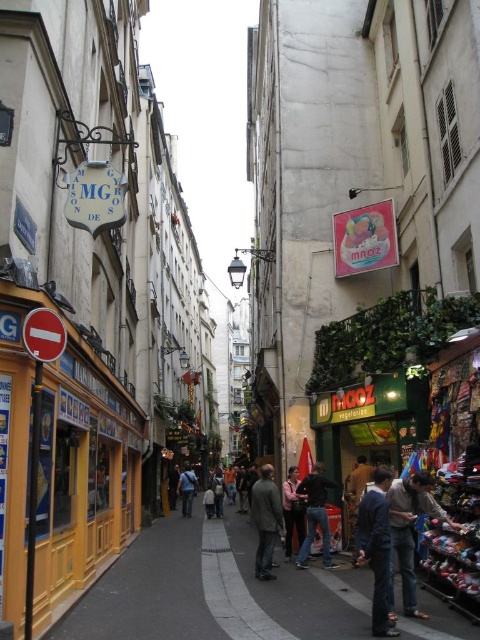
You are a delivery person carrying a package that is 10 cm thick. You need to pass through a narrow alley between the dark gray fabric jacket at center and the blue denim jeans at center. Can you fit through the space between them?

The dark gray fabric jacket at center is thinner than the blue denim jeans at center. Since the jacket is thinner, the space between them might be sufficient for the package. However, without knowing the exact width of the alley, it is uncertain if the 10 cm thick package will fit. Consider checking the available space before proceeding.

You are a tourist standing on the narrow street in front of the yellow building with the sign. You notice two items at the center of your view. What is the position of the dark gray fabric jacket at center relative to the blue denim jeans at center?

The dark gray fabric jacket at center is located above the blue denim jeans at center.